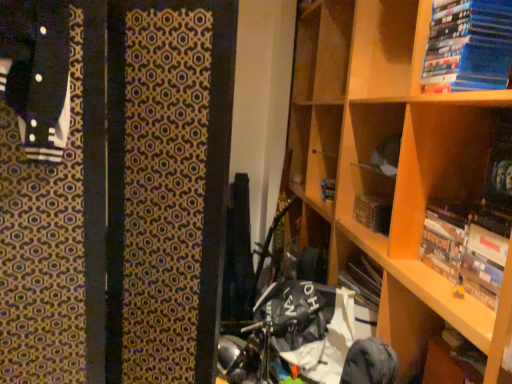
Question: Is blue matte book at upper right, marked as the 1th book in a top-to-bottom arrangement, at the left side of hardcover book at center?

Choices:
 (A) no
 (B) yes

Answer: (A)

Question: Considering the relative sizes of blue matte book at upper right, marked as the 1th book in a top-to-bottom arrangement, and hardcover book at center in the image provided, is blue matte book at upper right, marked as the 1th book in a top-to-bottom arrangement, bigger than hardcover book at center?

Choices:
 (A) no
 (B) yes

Answer: (B)

Question: Does blue matte book at upper right, marked as the 1th book in a top-to-bottom arrangement, appear on the right side of hardcover book at center?

Choices:
 (A) yes
 (B) no

Answer: (A)

Question: Can you confirm if blue matte book at upper right, marked as the 1th book in a top-to-bottom arrangement, is wider than hardcover book at center?

Choices:
 (A) yes
 (B) no

Answer: (A)

Question: Is blue matte book at upper right, acting as the second book starting from the bottom, outside hardcover book at center?

Choices:
 (A) no
 (B) yes

Answer: (B)

Question: Are blue matte book at upper right, marked as the 1th book in a top-to-bottom arrangement, and hardcover book at center far apart?

Choices:
 (A) no
 (B) yes

Answer: (A)

Question: From the image's perspective, is blue matte book at upper right, marked as the 1th book in a top-to-bottom arrangement, on hardcover book at upper right, the first book in the bottom-to-top sequence?

Choices:
 (A) no
 (B) yes

Answer: (B)

Question: From a real-world perspective, is blue matte book at upper right, acting as the second book starting from the bottom, positioned under hardcover book at upper right, positioned as the second book in top-to-bottom order, based on gravity?

Choices:
 (A) yes
 (B) no

Answer: (B)

Question: Does blue matte book at upper right, marked as the 1th book in a top-to-bottom arrangement, appear on the right side of hardcover book at upper right, the first book in the bottom-to-top sequence?

Choices:
 (A) yes
 (B) no

Answer: (B)

Question: Could you tell me if blue matte book at upper right, marked as the 1th book in a top-to-bottom arrangement, is facing hardcover book at upper right, the first book in the bottom-to-top sequence?

Choices:
 (A) no
 (B) yes

Answer: (A)

Question: From a real-world perspective, is blue matte book at upper right, acting as the second book starting from the bottom, positioned over hardcover book at upper right, the first book in the bottom-to-top sequence, based on gravity?

Choices:
 (A) yes
 (B) no

Answer: (A)

Question: Can you confirm if blue matte book at upper right, acting as the second book starting from the bottom, is wider than hardcover book at upper right, positioned as the second book in top-to-bottom order?

Choices:
 (A) yes
 (B) no

Answer: (A)

Question: Would you say wooden bookshelf at upper right contains blue matte book at upper right, marked as the 1th book in a top-to-bottom arrangement?

Choices:
 (A) yes
 (B) no

Answer: (A)